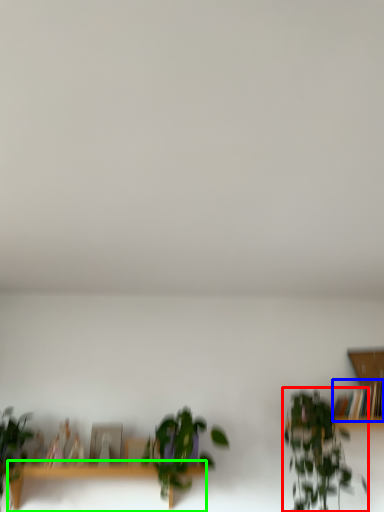
Question: Considering the real-world distances, which object is closest to houseplant (highlighted by a red box)? book (highlighted by a blue box) or table (highlighted by a green box).

Choices:
 (A) book
 (B) table

Answer: (A)